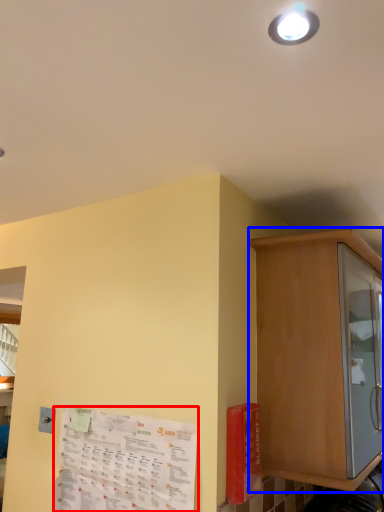
Question: Among these objects, which one is farthest to the camera, paper (highlighted by a red box) or cabinetry (highlighted by a blue box)?

Choices:
 (A) paper
 (B) cabinetry

Answer: (B)